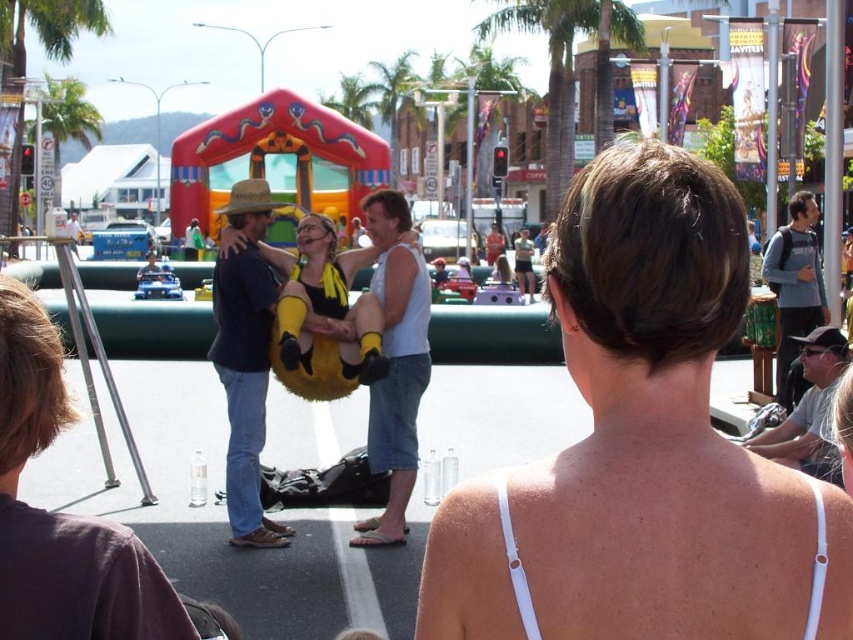
You are a photographer at the event and want to capture a photo that includes both the white fabric bikini top at upper center and the white tank top at center. Which one should you position to the right side of your frame to ensure both are visible?

To ensure both the white fabric bikini top at upper center and the white tank top at center are visible, position the white fabric bikini top at upper center to the right side of your frame since it is already to the right of the white tank top at center.

You are a photographer trying to capture the woman in the white tank top who is facing away from the camera. You notice a point marked at coordinates (642,445). What object is located at that point?

The point at coordinates (642,445) indicates the white fabric bikini top at upper center.

You are a photographer trying to capture the entire scene in one shot. Considering the white tank top at center and the gray cotton hoodie at upper right, which one is smaller in the image?

The white tank top at center is smaller in the image because it occupies less space than the gray cotton hoodie at upper right.